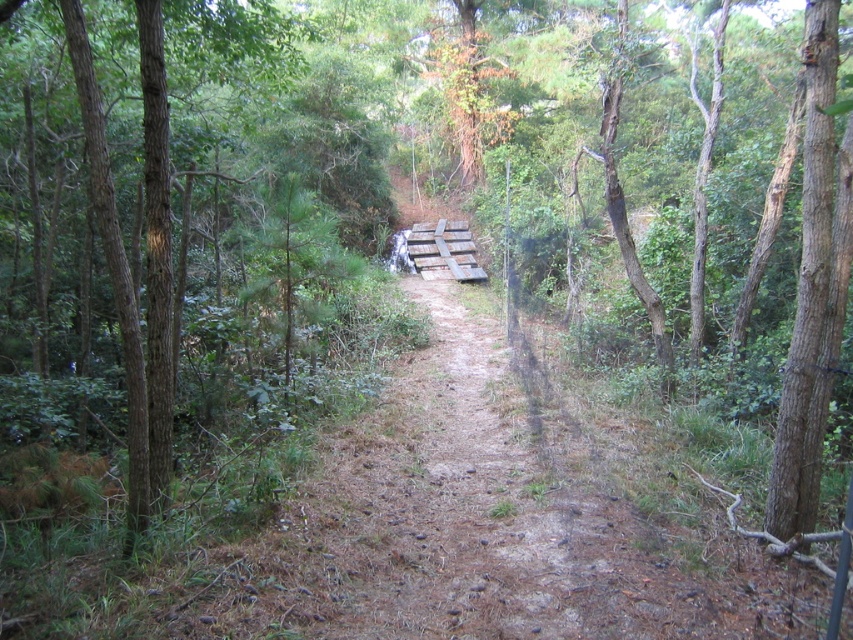
You are a hiker walking along the dirt path in the forest. You notice a brown textured tree at left and a brown rough bark tree at right. Which tree is closer to you as you walk the path?

The brown textured tree at left is closer to you because it is positioned further to the viewer than the brown rough bark tree at right, meaning it appears nearer in your line of sight.

You are a hiker carrying a 1.5 meter long ladder. You need to place it between the brown textured tree at left and the brown rough bark tree at right. Will the ladder fit horizontally between them?

The brown textured tree at left is shorter than the brown rough bark tree at right, so the ladder may not fit horizontally between them because the shorter tree might not provide enough vertical space. However, the description does not specify the distance between the trees, so we cannot confirm the horizontal fit based on height alone.

You are a hiker walking along the dirt path in the forest. You notice two trees ahead of you. One is a brown textured tree at left and the other is a brown rough bark tree at right. Which tree is located to the left of the other?

The brown textured tree at left is positioned on the left side of the brown rough bark tree at right.